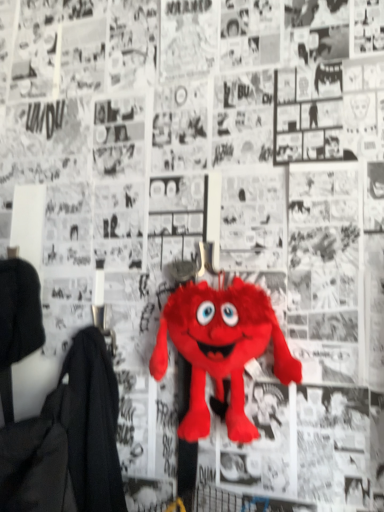
Where is `fluffy red plush toy at center`? The height and width of the screenshot is (512, 384). fluffy red plush toy at center is located at coordinates (221, 349).

What is the approximate width of fluffy red plush toy at center?

fluffy red plush toy at center is 3.12 inches wide.

The width and height of the screenshot is (384, 512). What do you see at coordinates (221, 349) in the screenshot?
I see `fluffy red plush toy at center` at bounding box center [221, 349].

In order to click on fluffy red plush toy at center in this screenshot , I will do click(221, 349).